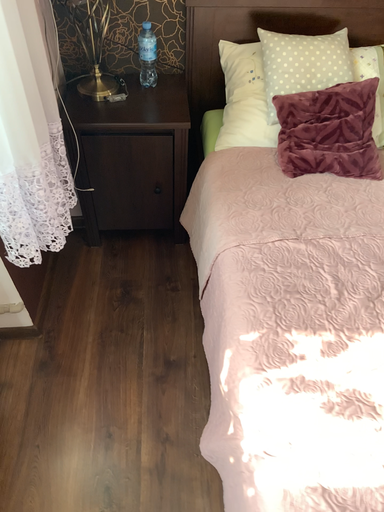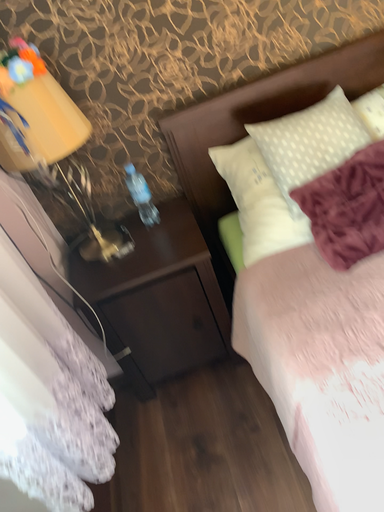
Question: How did the camera likely rotate when shooting the video?

Choices:
 (A) rotated right
 (B) rotated left

Answer: (B)